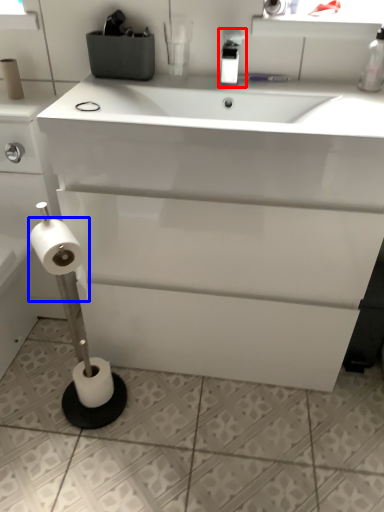
Question: Which point is further to the camera, bottle (highlighted by a red box) or toilet paper (highlighted by a blue box)?

Choices:
 (A) bottle
 (B) toilet paper

Answer: (A)